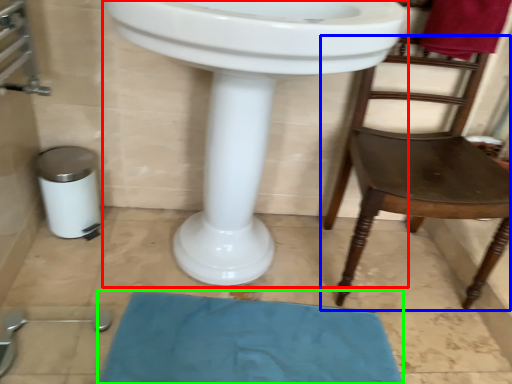
Question: Considering the real-world distances, which object is closest to sink (highlighted by a red box)? chair (highlighted by a blue box) or bath mat (highlighted by a green box).

Choices:
 (A) chair
 (B) bath mat

Answer: (B)